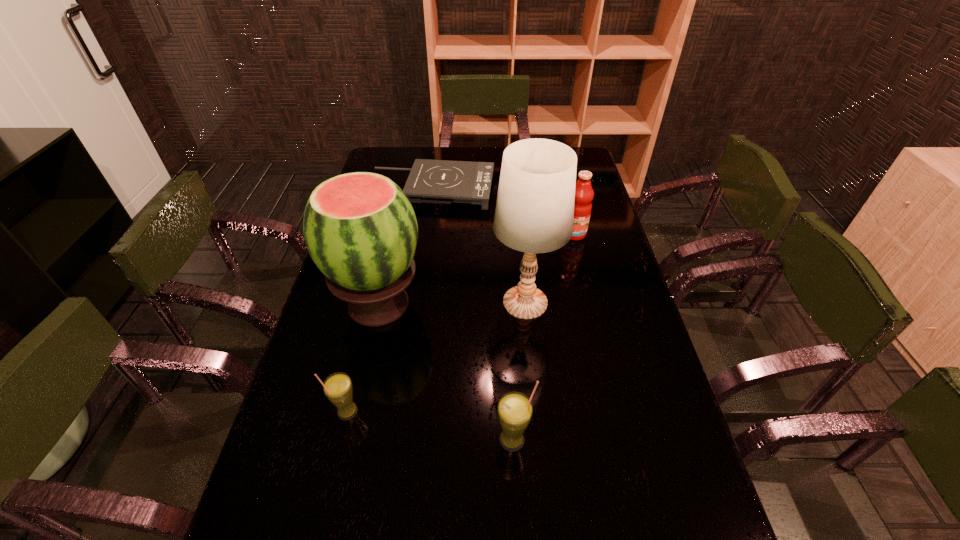
Please point out where to position a new straw for drinking on the right to maintain spacing. Please provide its 2D coordinates. Your answer should be formatted as a tuple, i.e. [(x, y)], where the tuple contains the x and y coordinates of a point satisfying the conditions above.

[(696, 470)]